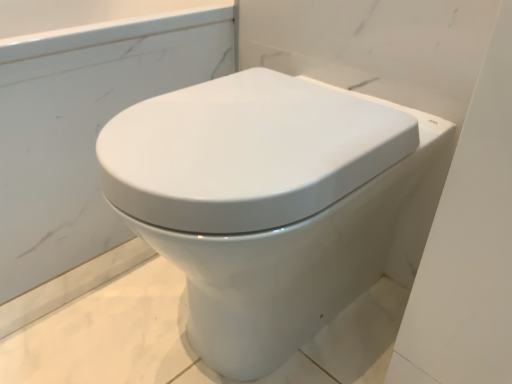
Locate an element on the screen. This screenshot has width=512, height=384. free space that is to the left of white glossy toilet at center is located at coordinates (91, 298).